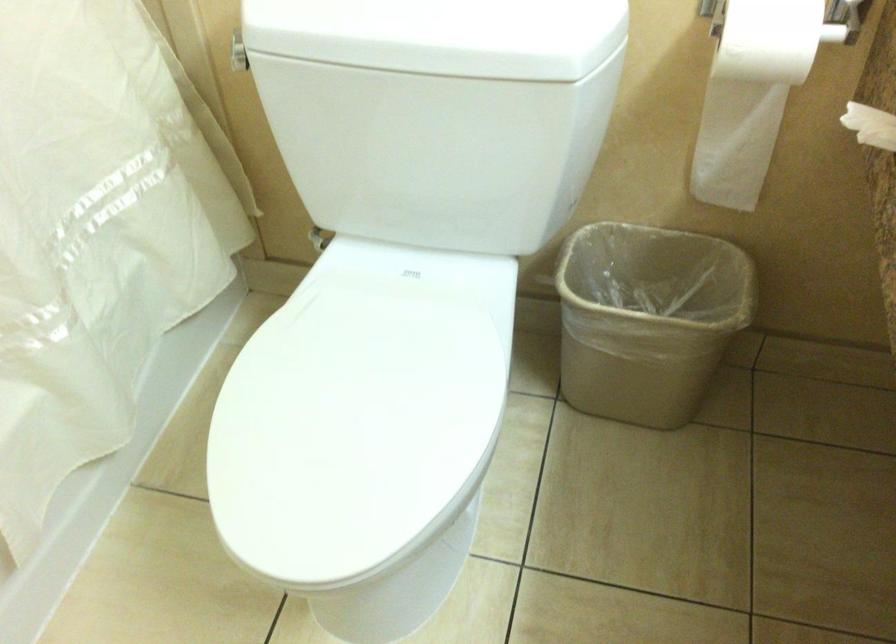
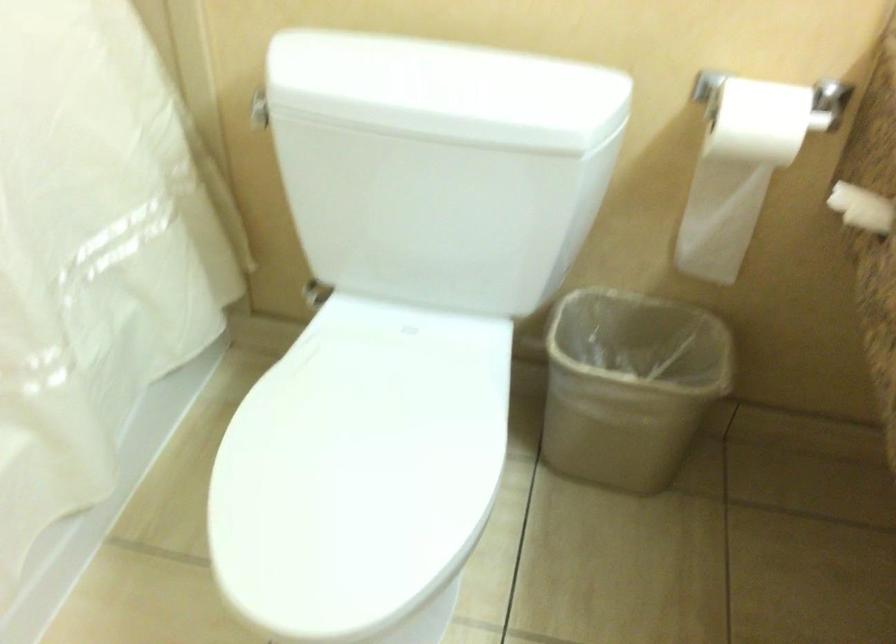
The point at (640, 322) is marked in the first image. Where is the corresponding point in the second image?

(629, 384)